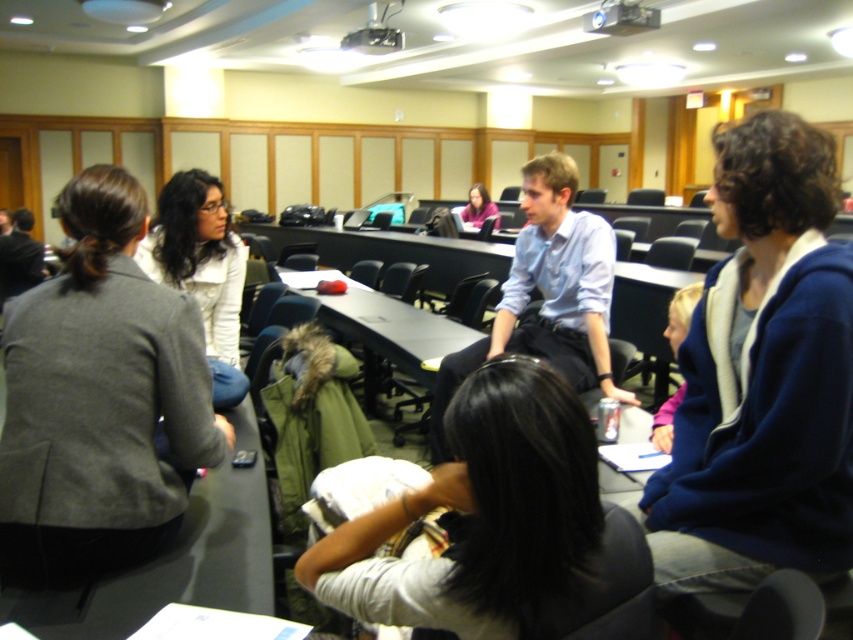
You are organizing a clothing donation drive and need to determine which jacket can fit into a standard donation box that accommodates items up to 30 cm in width. Given the blue fleece jacket at right and the gray wool jacket at left, which one is more likely to fit in the box?

The blue fleece jacket at right has a width less than the gray wool jacket at left, so the blue fleece jacket at right is more likely to fit in the donation box since it is narrower.

You are organizing a group discussion in the lecture hall and need to move a 5.5 meter long banner between the blue fleece jacket at right and the gray wool jacket at left. Can the banner fit through the space between them without bending?

The distance between the blue fleece jacket at right and the gray wool jacket at left is 6.13 meters. Since the banner is 5.5 meters long, it can fit through the space between them without bending.

What object is located at the coordinates point (386, 330)?

The matte black table at center is located at point (386, 330).